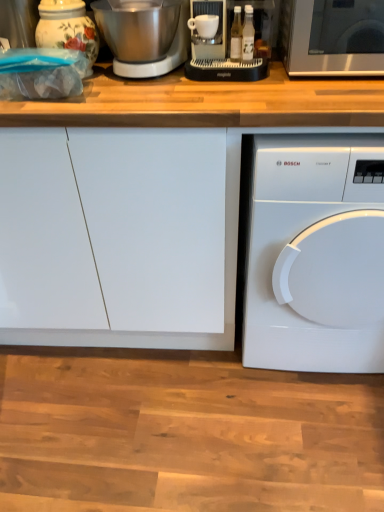
Locate an element on the screen. porcelain floral jar at upper left is located at coordinates (67, 28).

Describe the element at coordinates (230, 42) in the screenshot. I see `matte black coffee machine at upper center` at that location.

From the picture: What is the approximate height of white glossy dishwasher at lower right?

85.04 centimeters.

Image resolution: width=384 pixels, height=512 pixels. I want to click on porcelain floral jar at upper left, so click(x=67, y=28).

Is white glossy dishwasher at lower right taller than porcelain floral jar at upper left?

Yes, white glossy dishwasher at lower right is taller than porcelain floral jar at upper left.

How different are the orientations of white glossy dishwasher at lower right and porcelain floral jar at upper left in degrees?

The angular difference between white glossy dishwasher at lower right and porcelain floral jar at upper left is 0.0971 degrees.

Where is `appliance lying behind the white glossy dishwasher at lower right`? appliance lying behind the white glossy dishwasher at lower right is located at coordinates (67, 28).

Is white glossy dishwasher at lower right placed right next to porcelain floral jar at upper left?

No, white glossy dishwasher at lower right is not next to porcelain floral jar at upper left.

From their relative heights in the image, would you say porcelain floral jar at upper left is taller or shorter than white glossy dishwasher at lower right?

Clearly, porcelain floral jar at upper left is shorter compared to white glossy dishwasher at lower right.

Considering the positions of objects porcelain floral jar at upper left and white glossy dishwasher at lower right in the image provided, who is more to the right, porcelain floral jar at upper left or white glossy dishwasher at lower right?

white glossy dishwasher at lower right.

This screenshot has width=384, height=512. In order to click on home appliance located below the porcelain floral jar at upper left (from the image's perspective) in this screenshot , I will do `click(316, 256)`.

Is porcelain floral jar at upper left located outside white glossy dishwasher at lower right?

porcelain floral jar at upper left lies outside white glossy dishwasher at lower right's area.

Can sleek silver microwave at upper right be found inside brushed metal mixer at upper left?

Definitely not — sleek silver microwave at upper right is not inside brushed metal mixer at upper left.

Between brushed metal mixer at upper left and sleek silver microwave at upper right, which one is positioned in front?

Positioned in front is sleek silver microwave at upper right.

Is brushed metal mixer at upper left next to sleek silver microwave at upper right and touching it?

No, brushed metal mixer at upper left is not next to sleek silver microwave at upper right.

From the image's perspective, who appears lower, brushed metal mixer at upper left or sleek silver microwave at upper right?

sleek silver microwave at upper right.

Which object is positioned more to the right, brushed metal mixer at upper left or matte black coffee machine at upper center?

From the viewer's perspective, matte black coffee machine at upper center appears more on the right side.

Measure the distance from brushed metal mixer at upper left to matte black coffee machine at upper center.

brushed metal mixer at upper left is 5.23 inches away from matte black coffee machine at upper center.

Which is more distant, (129, 66) or (262, 10)?

Point (262, 10)

From the image's perspective, which one is positioned higher, brushed metal mixer at upper left or matte black coffee machine at upper center?

matte black coffee machine at upper center.

Could you tell me if matte black coffee machine at upper center is facing wooden at upper center?

No, matte black coffee machine at upper center is not aimed at wooden at upper center.

In the scene shown: Which object is closer to the camera, matte black coffee machine at upper center or wooden at upper center?

wooden at upper center is in front.

Who is shorter, matte black coffee machine at upper center or wooden at upper center?

Standing shorter between the two is matte black coffee machine at upper center.

From a real-world perspective, is wooden at upper center under matte black coffee machine at upper center?

Indeed, from a real-world perspective, wooden at upper center is positioned beneath matte black coffee machine at upper center.

Choose the correct answer: Is wooden at upper center inside matte black coffee machine at upper center or outside it?

wooden at upper center lies outside matte black coffee machine at upper center.

Looking at the image, does wooden at upper center seem bigger or smaller compared to matte black coffee machine at upper center?

In the image, wooden at upper center appears to be larger than matte black coffee machine at upper center.

Considering the points (179, 110) and (238, 64), which point is in front, point (179, 110) or point (238, 64)?

The point (179, 110) is in front.

This screenshot has width=384, height=512. I want to click on mixer on the left of white glossy dishwasher at lower right, so click(165, 57).

Is brushed metal mixer at upper left at the back of white glossy dishwasher at lower right?

Answer: No, white glossy dishwasher at lower right is not facing away from brushed metal mixer at upper left.

Does point (345, 238) appear closer or farther from the camera than point (119, 68)?

Point (345, 238) is positioned closer to the camera compared to point (119, 68).

What's the angular difference between white glossy dishwasher at lower right and brushed metal mixer at upper left's facing directions?

1.46 degrees.

Find the location of `home appliance directly beneath the porcelain floral jar at upper left (from a real-world perspective)`. home appliance directly beneath the porcelain floral jar at upper left (from a real-world perspective) is located at coordinates (316, 256).

Image resolution: width=384 pixels, height=512 pixels. I want to click on appliance located above the white glossy dishwasher at lower right (from a real-world perspective), so pyautogui.click(x=67, y=28).

Which object lies further to the anchor point brushed metal mixer at upper left, wooden at upper center or matte black coffee machine at upper center?

The object further to brushed metal mixer at upper left is wooden at upper center.

Estimate the real-world distances between objects in this image. Which object is further from brushed metal mixer at upper left, sleek silver microwave at upper right or wooden at upper center?

Among the two, sleek silver microwave at upper right is located further to brushed metal mixer at upper left.

Based on their spatial positions, is porcelain floral jar at upper left or white glossy dishwasher at lower right further from matte black coffee machine at upper center?

white glossy dishwasher at lower right lies further to matte black coffee machine at upper center than the other object.

Based on their spatial positions, is porcelain floral jar at upper left or matte black coffee machine at upper center further from wooden at upper center?

Among the two, porcelain floral jar at upper left is located further to wooden at upper center.

Looking at the image, which one is located closer to porcelain floral jar at upper left, white glossy dishwasher at lower right or matte black coffee machine at upper center?

matte black coffee machine at upper center is positioned closer to the anchor porcelain floral jar at upper left.

Looking at the image, which one is located further to porcelain floral jar at upper left, brushed metal mixer at upper left or wooden at upper center?

Among the two, wooden at upper center is located further to porcelain floral jar at upper left.

When comparing their distances from brushed metal mixer at upper left, does sleek silver microwave at upper right or porcelain floral jar at upper left seem closer?

porcelain floral jar at upper left is closer to brushed metal mixer at upper left.

Looking at the image, which one is located closer to brushed metal mixer at upper left, porcelain floral jar at upper left or wooden at upper center?

porcelain floral jar at upper left is positioned closer to the anchor brushed metal mixer at upper left.

The image size is (384, 512). Identify the location of appliance that lies between matte black coffee machine at upper center and wooden at upper center from top to bottom. (67, 28).

Locate an element on the screen. food processor between porcelain floral jar at upper left and white glossy dishwasher at lower right is located at coordinates (230, 42).

Locate an element on the screen. The image size is (384, 512). mixer located between porcelain floral jar at upper left and matte black coffee machine at upper center in the left-right direction is located at coordinates (165, 57).

At what (x,y) coordinates should I click in order to perform the action: click on microwave oven between porcelain floral jar at upper left and white glossy dishwasher at lower right from left to right. Please return your answer as a coordinate pair (x, y). Image resolution: width=384 pixels, height=512 pixels. Looking at the image, I should click on (333, 37).